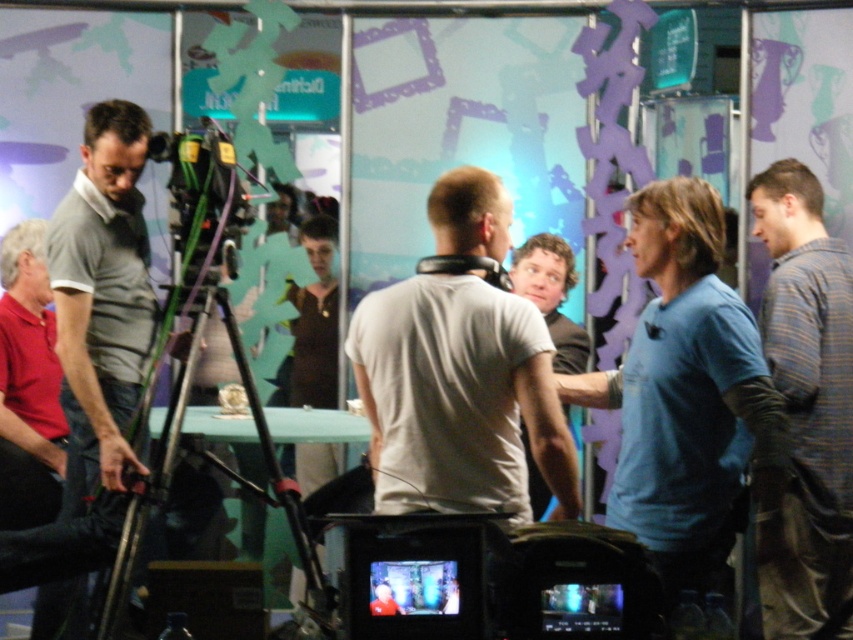
Is gray polo shirt at left positioned behind light gray t-shirt at center?

No.

Can you confirm if gray polo shirt at left is positioned to the left of light gray t-shirt at center?

Yes, gray polo shirt at left is to the left of light gray t-shirt at center.

Between point (125, 497) and point (566, 333), which one is positioned behind?

Point (566, 333)

Image resolution: width=853 pixels, height=640 pixels. What are the coordinates of `gray polo shirt at left` in the screenshot? It's located at (94, 356).

Is red cotton polo shirt at left to the right of black metal tripod at center from the viewer's perspective?

No, red cotton polo shirt at left is not to the right of black metal tripod at center.

Is point (33, 349) less distant than point (177, 401)?

No.

I want to click on red cotton polo shirt at left, so click(28, 385).

Between point (67, 291) and point (45, 493), which one is positioned behind?

The point (45, 493) is behind.

Between gray polo shirt at left and red cotton polo shirt at left, which one appears on the left side from the viewer's perspective?

Positioned to the left is red cotton polo shirt at left.

The image size is (853, 640). Describe the element at coordinates (94, 356) in the screenshot. I see `gray polo shirt at left` at that location.

The width and height of the screenshot is (853, 640). Identify the location of gray polo shirt at left. (94, 356).